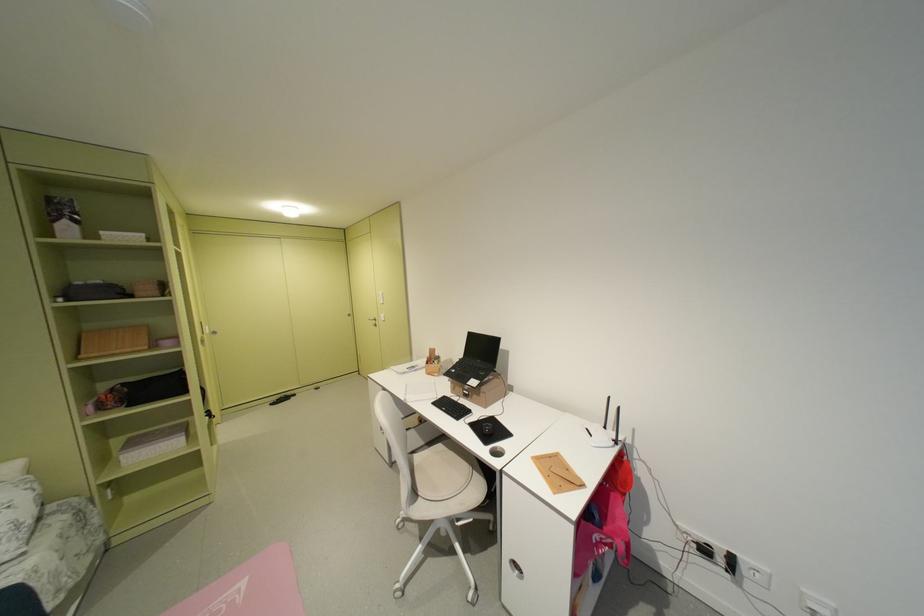
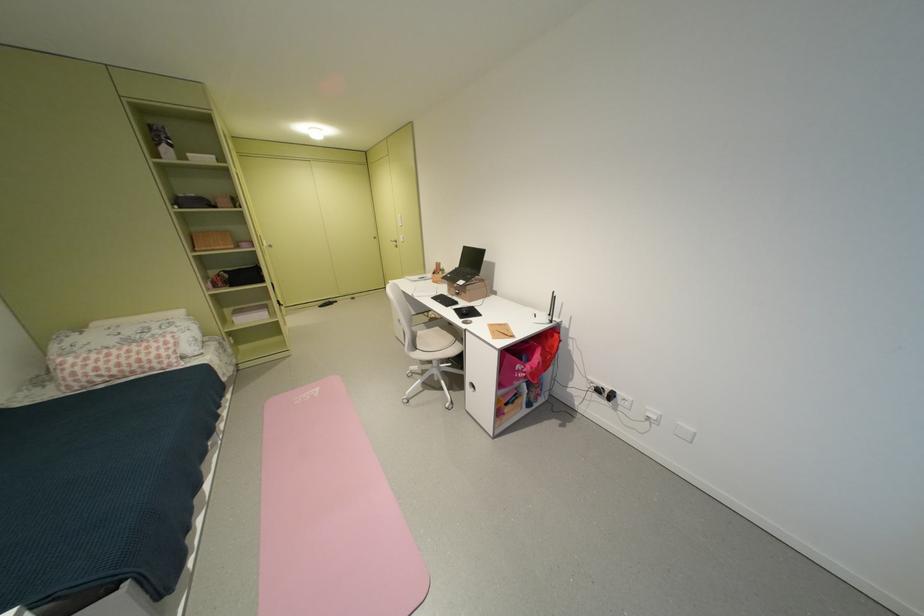
Find the pixel in the second image that matches pixel 429 495 in the first image.

(428, 349)